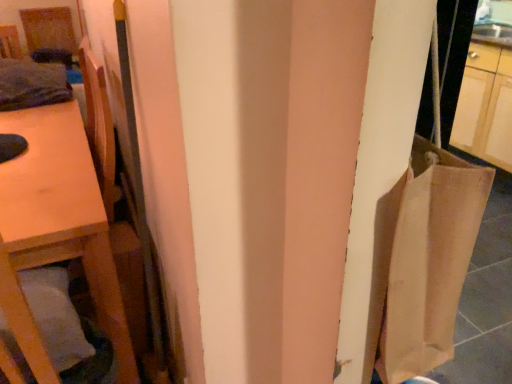
Question: Could you tell me if wooden table at left is turned towards white soft pillow at lower left?

Choices:
 (A) yes
 (B) no

Answer: (B)

Question: Is wooden table at left positioned behind white soft pillow at lower left?

Choices:
 (A) no
 (B) yes

Answer: (B)

Question: From a real-world perspective, does wooden table at left sit lower than white soft pillow at lower left?

Choices:
 (A) yes
 (B) no

Answer: (A)

Question: Does wooden table at left have a greater height compared to white soft pillow at lower left?

Choices:
 (A) no
 (B) yes

Answer: (B)

Question: Can you confirm if wooden table at left is bigger than white soft pillow at lower left?

Choices:
 (A) no
 (B) yes

Answer: (B)

Question: Does point (7, 336) appear closer or farther from the camera than point (117, 200)?

Choices:
 (A) closer
 (B) farther

Answer: (A)

Question: Would you say white soft pillow at lower left is to the left or to the right of wooden chair at left in the picture?

Choices:
 (A) right
 (B) left

Answer: (B)

Question: Is white soft pillow at lower left in front of or behind wooden chair at left in the image?

Choices:
 (A) front
 (B) behind

Answer: (A)

Question: Is white soft pillow at lower left taller or shorter than wooden chair at left?

Choices:
 (A) short
 (B) tall

Answer: (A)

Question: Is white soft pillow at lower left taller or shorter than wooden table at left?

Choices:
 (A) tall
 (B) short

Answer: (B)

Question: Is white soft pillow at lower left situated inside wooden table at left or outside?

Choices:
 (A) outside
 (B) inside

Answer: (B)

Question: Looking at their shapes, would you say white soft pillow at lower left is wider or thinner than wooden table at left?

Choices:
 (A) wide
 (B) thin

Answer: (B)

Question: From a real-world perspective, is white soft pillow at lower left physically located above or below wooden table at left?

Choices:
 (A) above
 (B) below

Answer: (A)

Question: Visually, is wooden table at left positioned to the left or to the right of white soft pillow at lower left?

Choices:
 (A) right
 (B) left

Answer: (B)

Question: Is wooden table at left taller or shorter than white soft pillow at lower left?

Choices:
 (A) short
 (B) tall

Answer: (B)